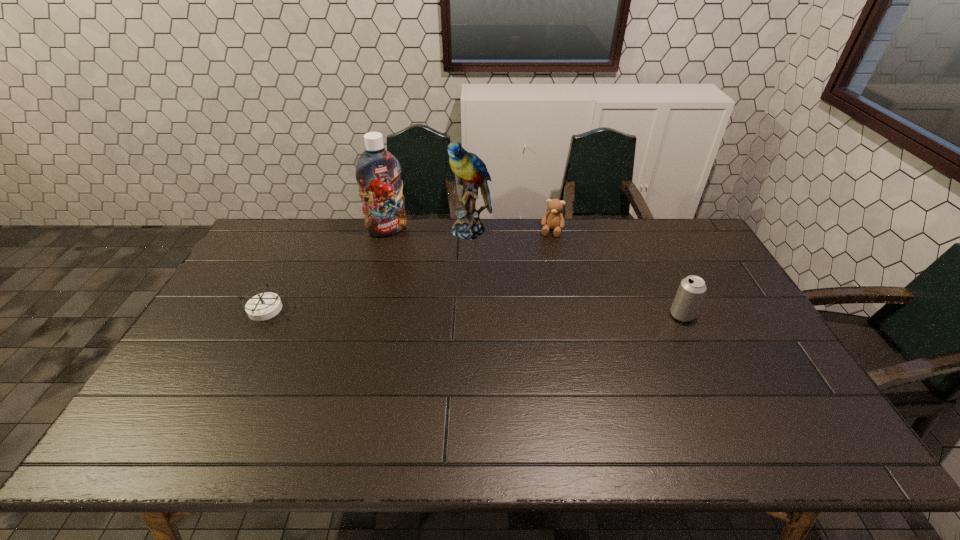
Where is `the shortest object`? Image resolution: width=960 pixels, height=540 pixels. the shortest object is located at coordinates pyautogui.click(x=264, y=306).

Where is `the leftmost object`? Image resolution: width=960 pixels, height=540 pixels. the leftmost object is located at coordinates (264, 306).

Where is `the rightmost object`? Image resolution: width=960 pixels, height=540 pixels. the rightmost object is located at coordinates (691, 291).

At what (x,y) coordinates should I click in order to perform the action: click on the third object from right to left. Please return your answer as a coordinate pair (x, y). This screenshot has width=960, height=540. Looking at the image, I should click on (471, 171).

Where is `shampoo`? The width and height of the screenshot is (960, 540). shampoo is located at coordinates (378, 172).

Find the location of a particular element. This screenshot has height=540, width=960. teddy bear is located at coordinates (553, 219).

Where is `vacant space located 0.350m on the right of the compass`? The image size is (960, 540). vacant space located 0.350m on the right of the compass is located at coordinates (402, 309).

Locate an element on the screen. vacant region located on the back of the beer can is located at coordinates (642, 232).

The height and width of the screenshot is (540, 960). What are the coordinates of `blank space located 0.330m on the face of the third object from left to right` in the screenshot? It's located at (428, 305).

This screenshot has width=960, height=540. In order to click on free location located 0.330m on the face of the third object from left to right in this screenshot , I will do `click(428, 305)`.